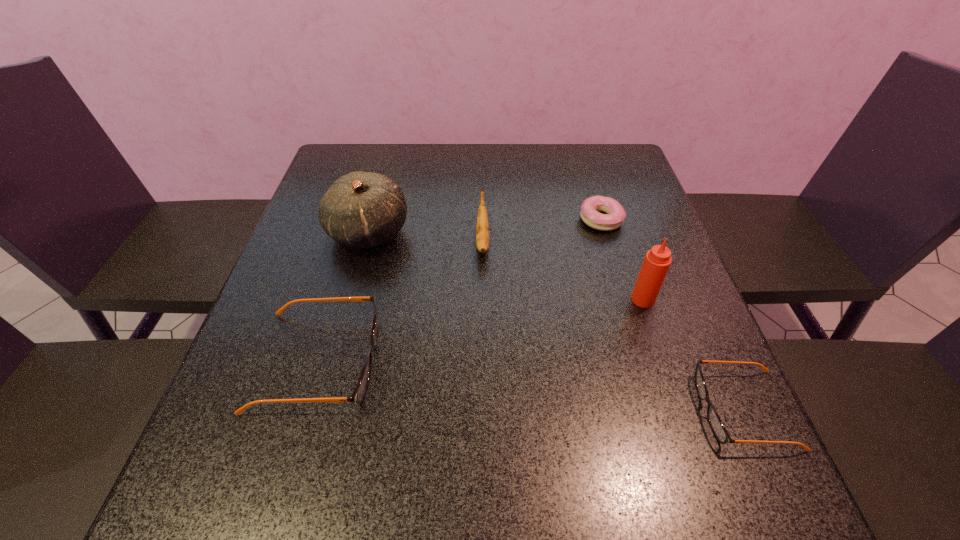
Where is `free spot located 0.060m on the front-facing side of the rightmost object`? The image size is (960, 540). free spot located 0.060m on the front-facing side of the rightmost object is located at coordinates (665, 409).

Locate an element on the screen. vacant point located 0.230m on the front-facing side of the rightmost object is located at coordinates (566, 409).

I want to click on vacant space positioned 0.190m on the front-facing side of the rightmost object, so click(x=589, y=409).

At what (x,y) coordinates should I click in order to perform the action: click on vacant space located on the front of the doughnut. Please return your answer as a coordinate pair (x, y). Image resolution: width=960 pixels, height=540 pixels. Looking at the image, I should click on (637, 341).

You are a GUI agent. You are given a task and a screenshot of the screen. Output one action in this format:
    pyautogui.click(x=<x>, y=<y>)
    Task: Click on the vacant space located on the back of the gourd
    The width and height of the screenshot is (960, 540).
    Given the screenshot: What is the action you would take?
    pyautogui.click(x=387, y=163)

In order to click on free region located 0.300m on the peel of the banana from the top in this screenshot , I will do `click(483, 381)`.

You are a GUI agent. You are given a task and a screenshot of the screen. Output one action in this format:
    pyautogui.click(x=<x>, y=<y>)
    Task: Click on the vacant area located on the back of the Tabasco sauce
    This screenshot has height=540, width=960.
    Given the screenshot: What is the action you would take?
    pyautogui.click(x=632, y=268)

Image resolution: width=960 pixels, height=540 pixels. I want to click on spectacles that is at the left edge, so click(x=357, y=396).

You are a GUI agent. You are given a task and a screenshot of the screen. Output one action in this format:
    pyautogui.click(x=<x>, y=<y>)
    Task: Click on the gourd at the left edge
    The height and width of the screenshot is (540, 960).
    Given the screenshot: What is the action you would take?
    pyautogui.click(x=361, y=209)

Image resolution: width=960 pixels, height=540 pixels. I want to click on spectacles at the right edge, so click(714, 420).